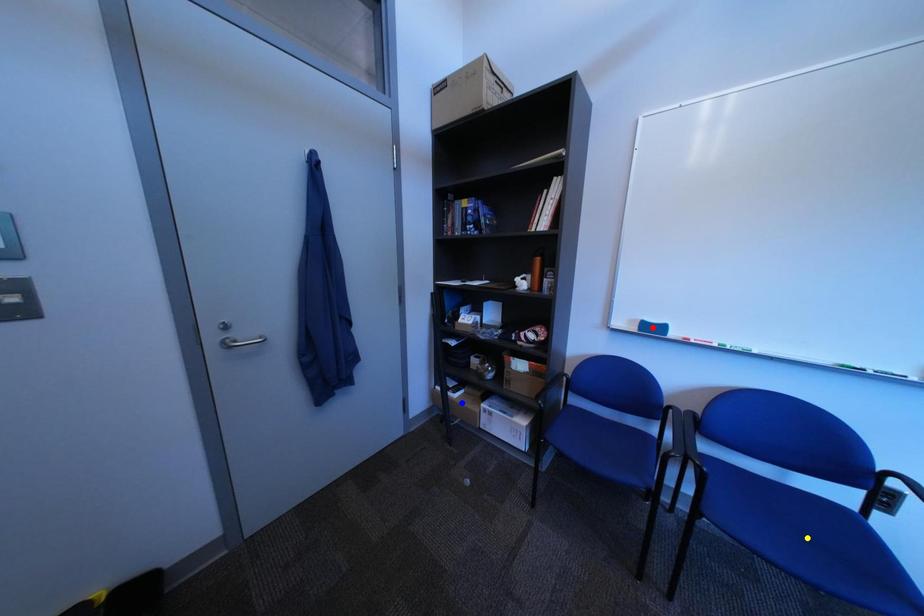
Order these from nearest to farthest:
blue point | yellow point | red point

yellow point
red point
blue point